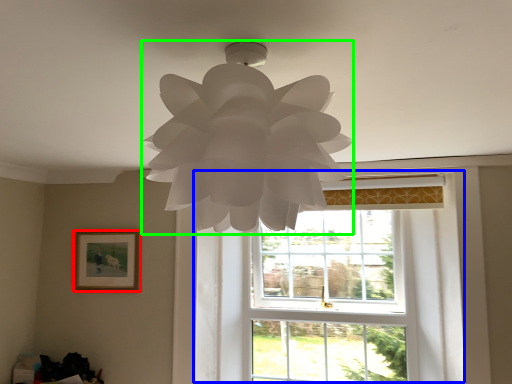
Question: Considering the real-world distances, which object is farthest from picture frame (highlighted by a red box)? window (highlighted by a blue box) or lamp (highlighted by a green box)?

Choices:
 (A) window
 (B) lamp

Answer: (B)